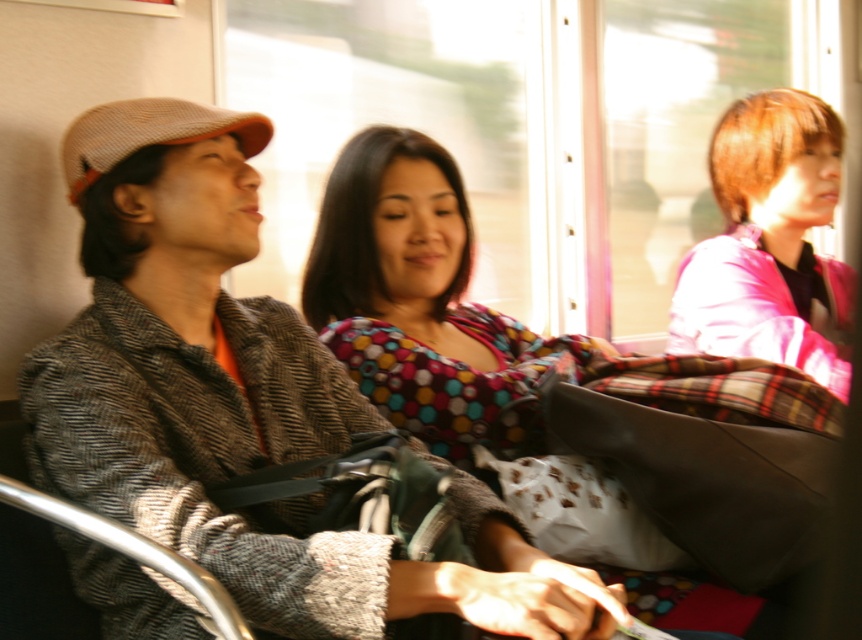
You are standing outside the train and looking through the window at the three people inside. You notice a specific point at coordinates (481, 320). What object is located exactly at that point?

The polka dot fabric dress at center is located exactly at point (481, 320).

You are a fashion designer observing the passengers on the train. You need to determine which of the two items, the polka dot fabric dress at center or the pink fabric at upper right, is taller. Which one is taller?

The polka dot fabric dress at center is taller than the pink fabric at upper right.